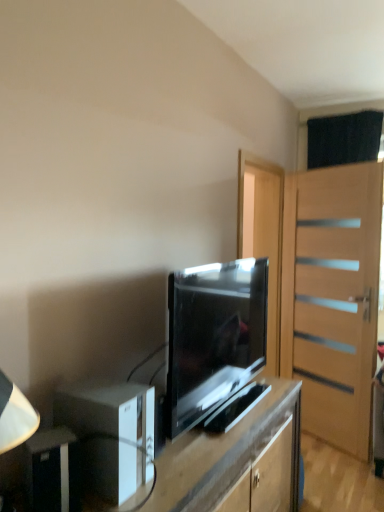
Question: Looking at their shapes, would you say matte black tv at center is wider or thinner than matte black tv stand at center?

Choices:
 (A) thin
 (B) wide

Answer: (A)

Question: Is matte black tv at center taller or shorter than matte black tv stand at center?

Choices:
 (A) tall
 (B) short

Answer: (B)

Question: Which object is the closest to the light brown wooden door at right?

Choices:
 (A) matte black tv at center
 (B) matte black tv stand at center
 (C) white glossy speaker at lower left, the 1th appliance viewed from the back
 (D) black plastic speaker at lower left, the first appliance viewed from the front

Answer: (A)

Question: Considering the real-world distances, which object is closest to the black plastic speaker at lower left, the first appliance viewed from the front?

Choices:
 (A) light brown wooden door at right
 (B) matte black tv at center
 (C) matte black tv stand at center
 (D) white glossy speaker at lower left, the 2th appliance viewed from the front

Answer: (D)